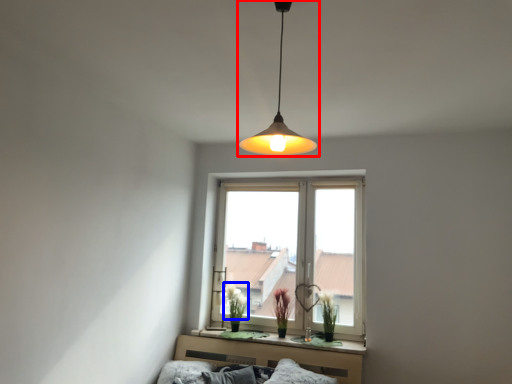
Question: Which object appears closest to the camera in this image, lamp (highlighted by a red box) or flower (highlighted by a blue box)?

Choices:
 (A) lamp
 (B) flower

Answer: (A)